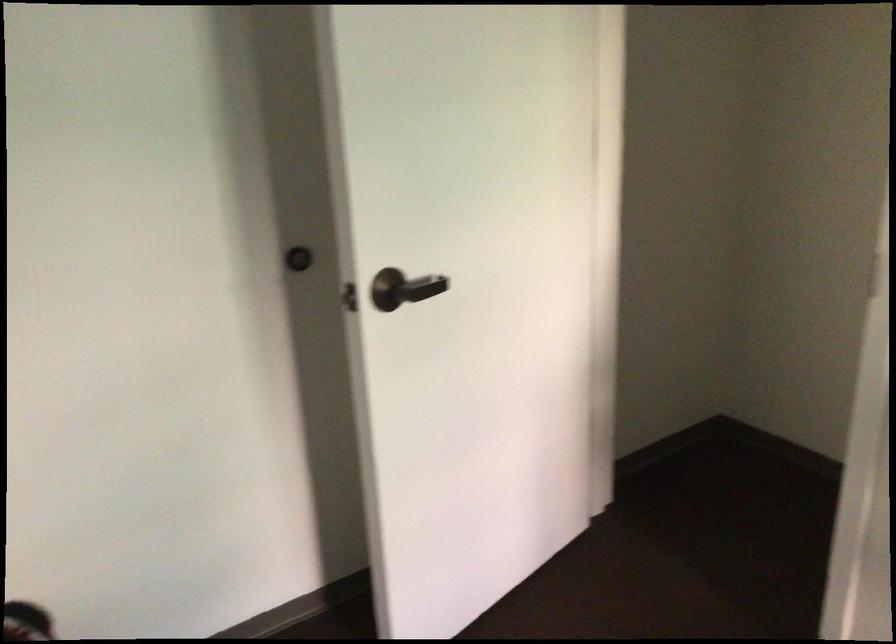
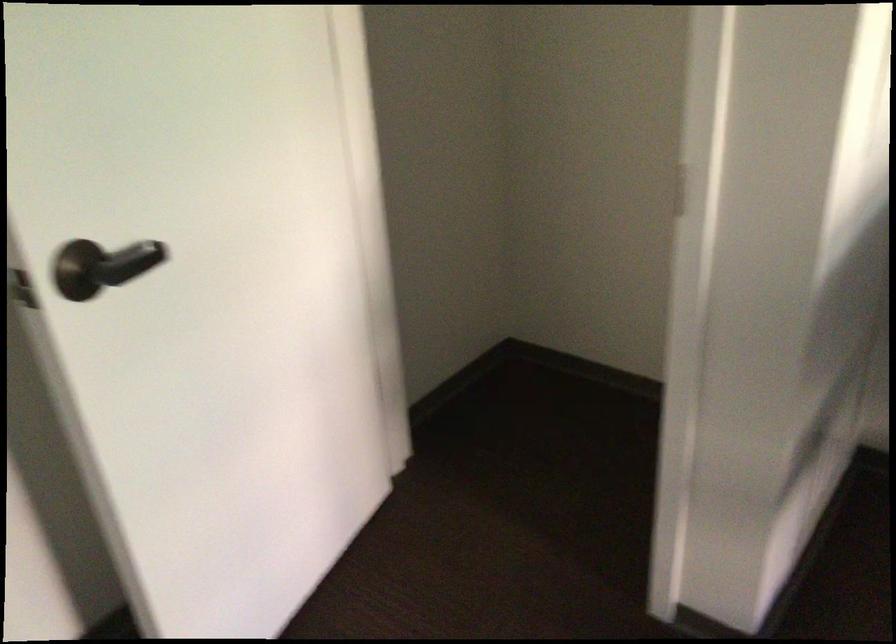
In the second image, find the point that corresponds to pixel 402 285 in the first image.

(107, 265)